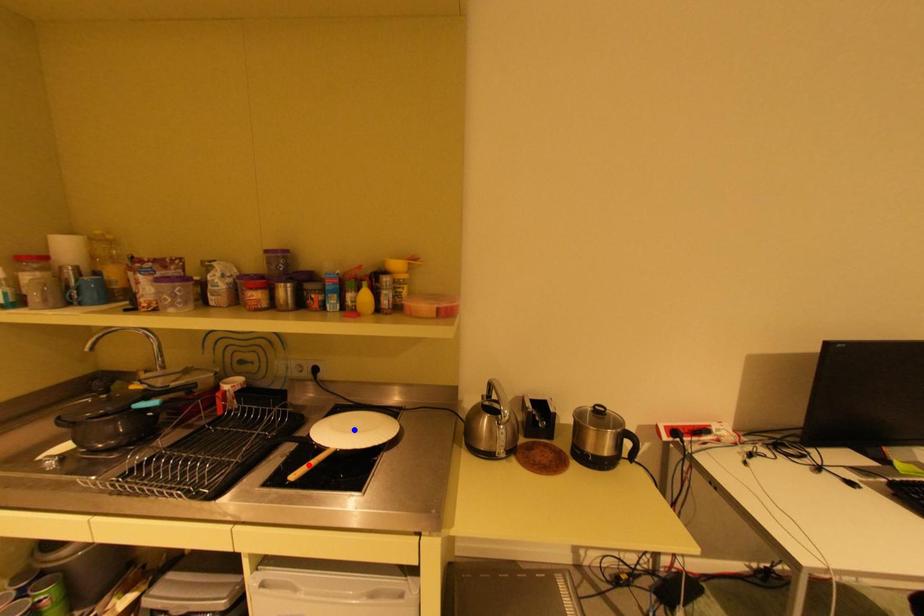
Question: In the image, two points are highlighted. Which point is nearer to the camera? Reply with the corresponding letter.

Choices:
 (A) blue point
 (B) red point

Answer: (B)